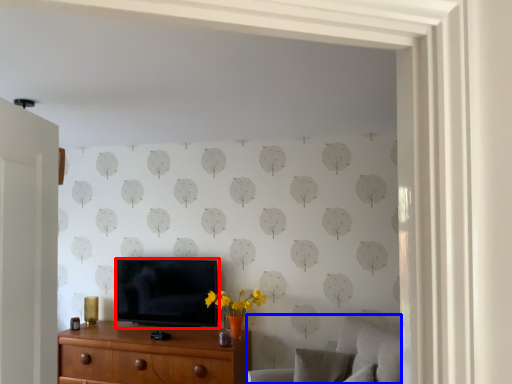
Question: Which object is further to the camera taking this photo, television (highlighted by a red box) or swivel chair (highlighted by a blue box)?

Choices:
 (A) television
 (B) swivel chair

Answer: (A)